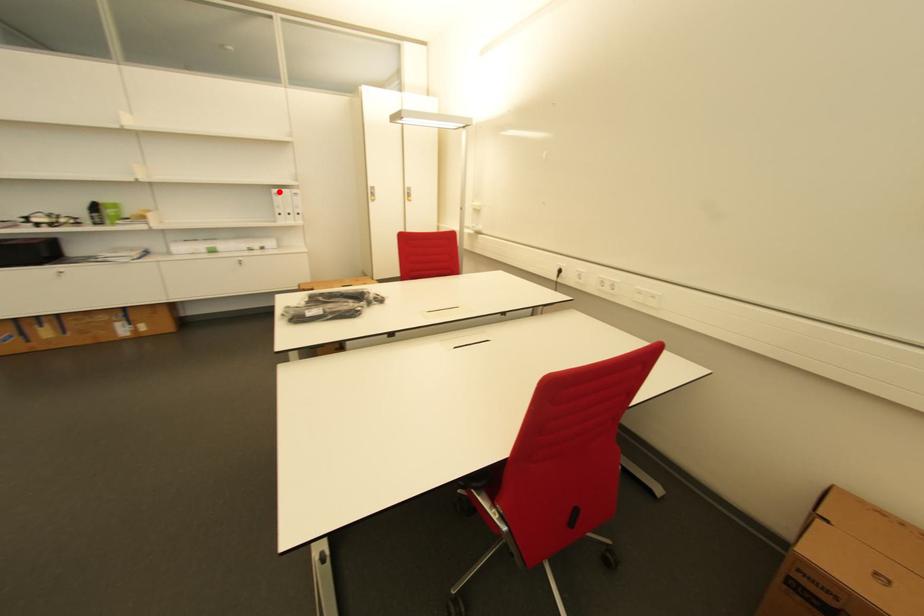
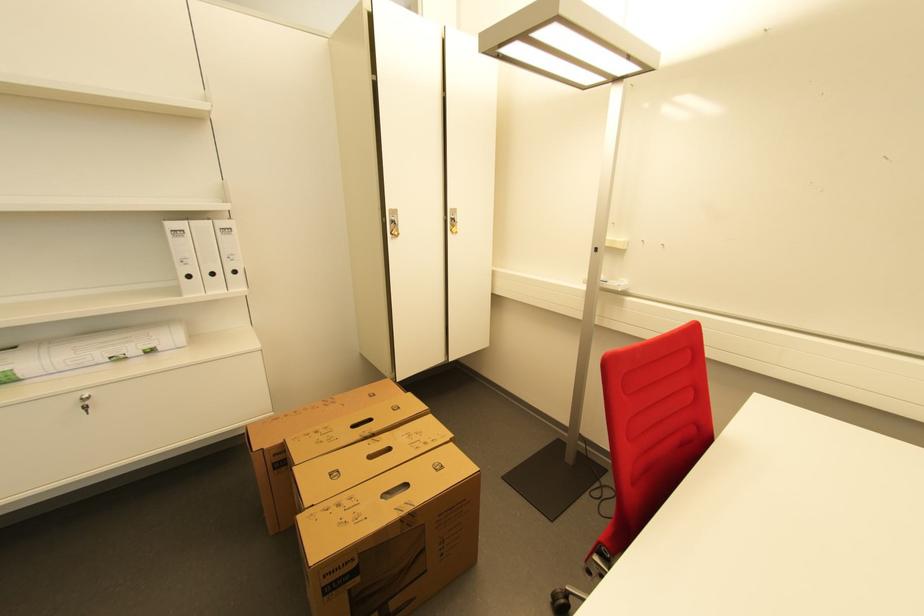
Locate, in the second image, the point that corresponds to the highlighted location in the first image.

(176, 225)